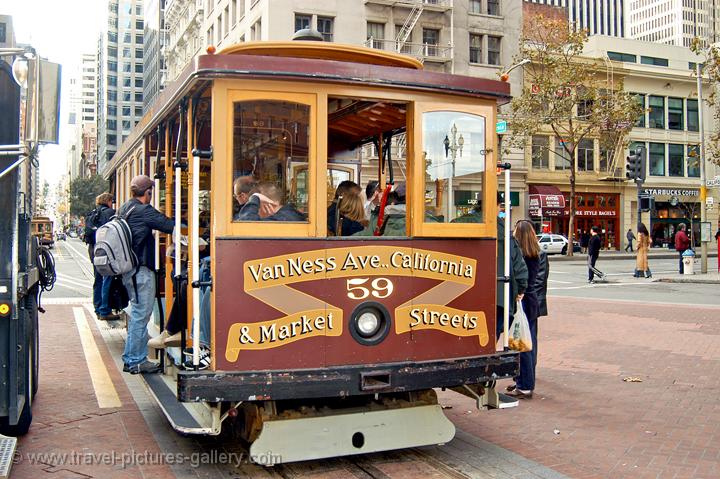
I want to click on trolley light, so click(x=368, y=321).